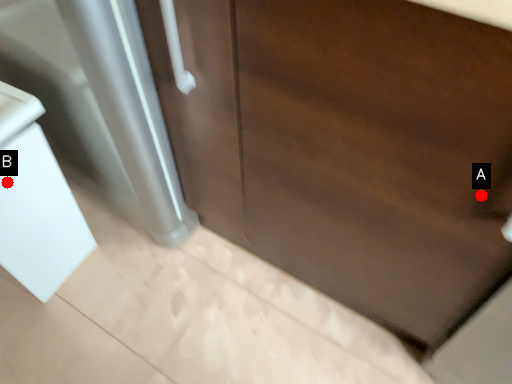
Question: Two points are circled on the image, labeled by A and B beside each circle. Which point is closer to the camera taking this photo?

Choices:
 (A) A is closer
 (B) B is closer

Answer: (A)